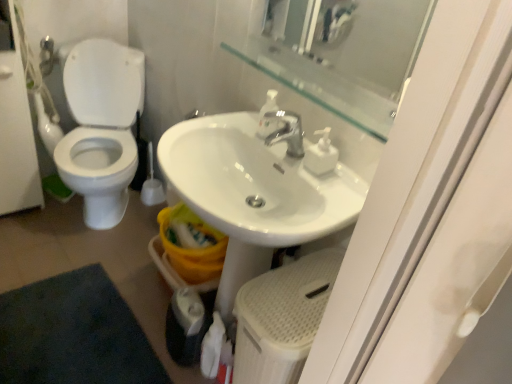
Question: Is white glossy screen door at left closer to camera compared to white matte toilet paper at lower center?

Choices:
 (A) yes
 (B) no

Answer: (B)

Question: Can you confirm if white glossy screen door at left is taller than white matte toilet paper at lower center?

Choices:
 (A) yes
 (B) no

Answer: (A)

Question: Is white glossy screen door at left positioned behind white matte toilet paper at lower center?

Choices:
 (A) yes
 (B) no

Answer: (A)

Question: Is the surface of white glossy screen door at left in direct contact with white matte toilet paper at lower center?

Choices:
 (A) no
 (B) yes

Answer: (A)

Question: Is white glossy screen door at left bigger than white matte toilet paper at lower center?

Choices:
 (A) no
 (B) yes

Answer: (B)

Question: Looking at their shapes, would you say white matte toilet paper at lower center is wider or thinner than transparent glass mirror at upper center?

Choices:
 (A) wide
 (B) thin

Answer: (B)

Question: Which is correct: white matte toilet paper at lower center is inside transparent glass mirror at upper center, or outside of it?

Choices:
 (A) inside
 (B) outside

Answer: (B)

Question: From their relative heights in the image, would you say white matte toilet paper at lower center is taller or shorter than transparent glass mirror at upper center?

Choices:
 (A) short
 (B) tall

Answer: (B)

Question: Is point (209, 332) positioned closer to the camera than point (254, 51)?

Choices:
 (A) closer
 (B) farther

Answer: (A)

Question: From the image's perspective, relative to white glossy screen door at left, is white glossy sink at center above or below?

Choices:
 (A) below
 (B) above

Answer: (A)

Question: In terms of size, does white glossy sink at center appear bigger or smaller than white glossy screen door at left?

Choices:
 (A) small
 (B) big

Answer: (A)

Question: Is white glossy sink at center to the left or to the right of white glossy screen door at left in the image?

Choices:
 (A) left
 (B) right

Answer: (B)

Question: Would you say white glossy sink at center is inside or outside white glossy screen door at left?

Choices:
 (A) inside
 (B) outside

Answer: (B)

Question: Is white plastic soap dispenser at center, which is the 2th soap dispenser in left-to-right order, taller or shorter than transparent glass mirror at upper center?

Choices:
 (A) short
 (B) tall

Answer: (B)

Question: Choose the correct answer: Is white plastic soap dispenser at center, the first soap dispenser viewed from the right, inside transparent glass mirror at upper center or outside it?

Choices:
 (A) inside
 (B) outside

Answer: (B)